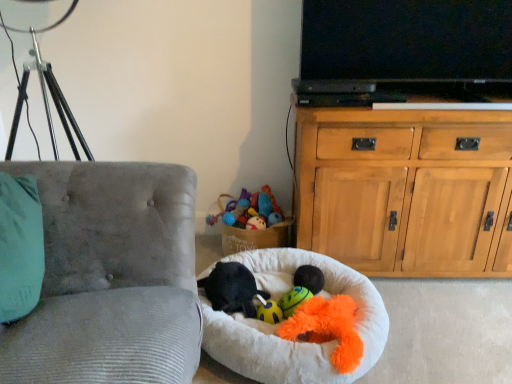
Question: Would you say wooden cabinet at right is inside or outside velvet gray chair at left?

Choices:
 (A) inside
 (B) outside

Answer: (B)

Question: Looking at their shapes, would you say wooden cabinet at right is wider or thinner than velvet gray chair at left?

Choices:
 (A) thin
 (B) wide

Answer: (A)

Question: Which of these objects is positioned closest to the white fluffy dog bed at center?

Choices:
 (A) velvet gray chair at left
 (B) wooden cabinet at right
 (C) fluffy orange plush toy at center, which is counted as the second toy, starting from the back
 (D) yellow rubber ball at center, which appears as the first toy when viewed from the back
 (E) black plush dog bed at lower center, which is the first animal in left-to-right order

Answer: (C)

Question: Which is farther from the black plush toy at center, which is counted as the 1th animal, starting from the right?

Choices:
 (A) wooden cabinet at right
 (B) white fluffy dog bed at center
 (C) yellow rubber ball at center, positioned as the 2th toy in front-to-back order
 (D) black plush dog bed at lower center, which is the first animal in left-to-right order
 (E) velvet gray chair at left

Answer: (E)